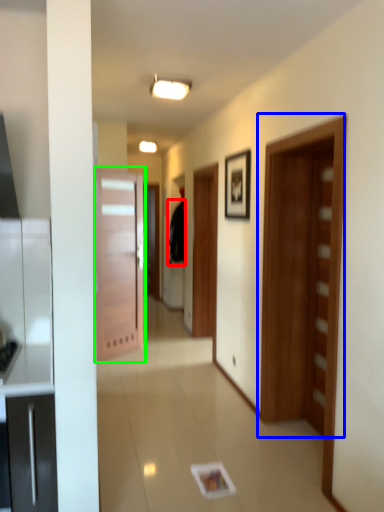
Question: Which object is the farthest from robe (highlighted by a red box)? Choose among these: door (highlighted by a blue box) or door (highlighted by a green box).

Choices:
 (A) door
 (B) door

Answer: (A)